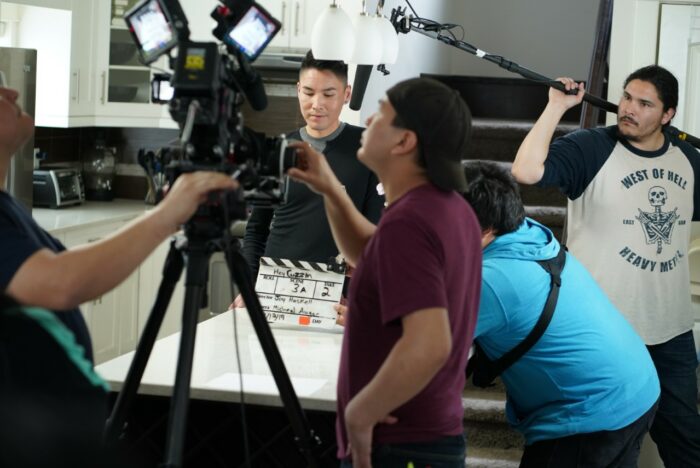
I want to click on square lights atop camera, so click(x=260, y=33), click(x=150, y=38).